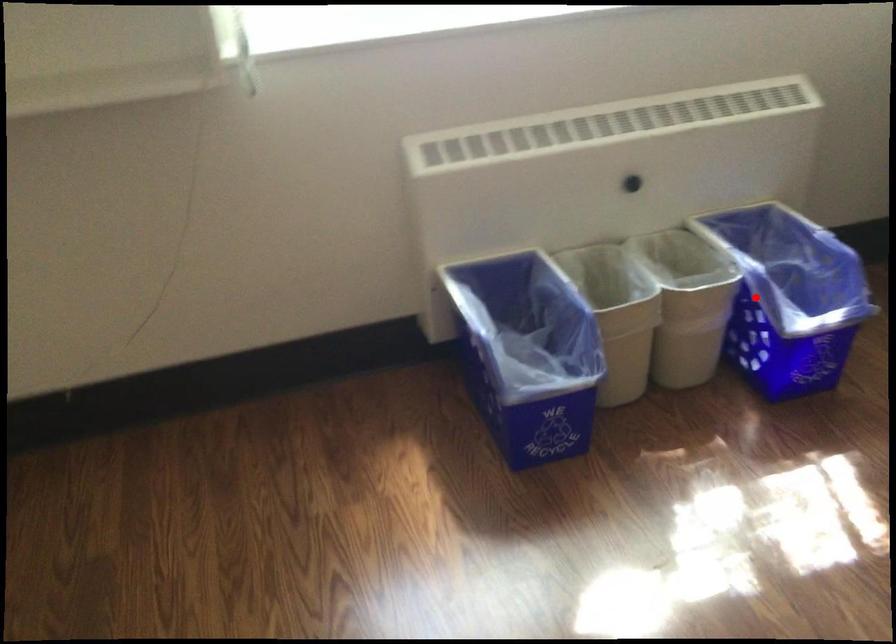
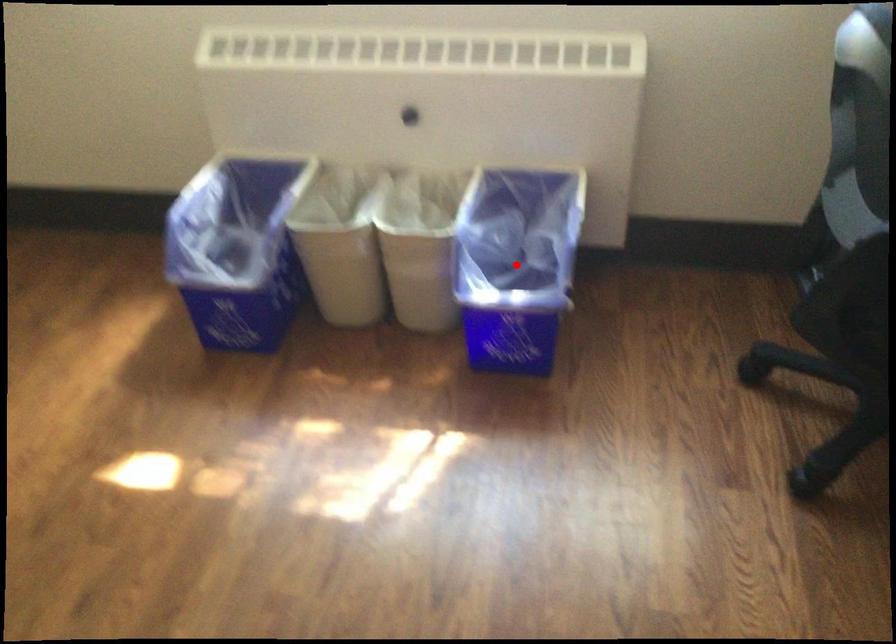
I am providing you with two images of the same scene from different viewpoints. A red point is marked on the first image and another point is marked on the second image. Do the highlighted points in image1 and image2 indicate the same real-world spot?

Yes